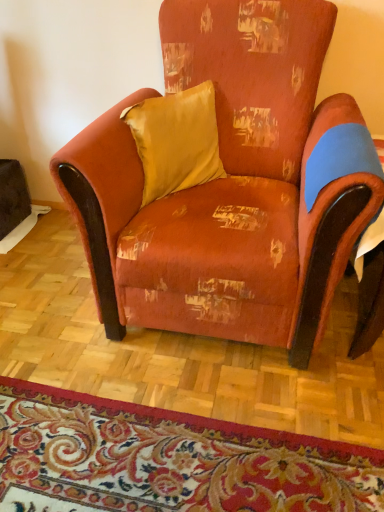
You are a GUI agent. You are given a task and a screenshot of the screen. Output one action in this format:
    pyautogui.click(x=<x>, y=<y>)
    Task: Click on the satin yellow pillow at upper center
    Image resolution: width=384 pixels, height=512 pixels.
    Given the screenshot: What is the action you would take?
    pyautogui.click(x=176, y=140)

In order to click on distressed orange fabric armchair at center in this screenshot , I will do `click(225, 187)`.

You are a GUI agent. You are given a task and a screenshot of the screen. Output one action in this format:
    pyautogui.click(x=<x>, y=<y>)
    Task: Click on the floral carpet at lower center
    The height and width of the screenshot is (512, 384).
    Given the screenshot: What is the action you would take?
    pyautogui.click(x=168, y=460)

From the picture: From the image's perspective, is distressed orange fabric armchair at center beneath satin yellow pillow at upper center?

Yes.

Is distressed orange fabric armchair at center thinner than satin yellow pillow at upper center?

No.

Considering the relative positions of distressed orange fabric armchair at center and satin yellow pillow at upper center in the image provided, is distressed orange fabric armchair at center to the left or to the right of satin yellow pillow at upper center?

In the image, distressed orange fabric armchair at center appears on the right side of satin yellow pillow at upper center.

In terms of height, does distressed orange fabric armchair at center look taller or shorter compared to satin yellow pillow at upper center?

In the image, distressed orange fabric armchair at center appears to be taller than satin yellow pillow at upper center.

Which is behind, point (329, 441) or point (266, 83)?

The point (266, 83) is farther.

Which of these two, floral carpet at lower center or distressed orange fabric armchair at center, is bigger?

Bigger between the two is distressed orange fabric armchair at center.

The image size is (384, 512). What are the coordinates of `chair that appears above the floral carpet at lower center (from the image's perspective)` in the screenshot? It's located at (225, 187).

Which of these two, floral carpet at lower center or distressed orange fabric armchair at center, stands taller?

With more height is distressed orange fabric armchair at center.

Is satin yellow pillow at upper center spatially inside distressed orange fabric armchair at center, or outside of it?

satin yellow pillow at upper center lies within the bounds of distressed orange fabric armchair at center.

From the image's perspective, is satin yellow pillow at upper center below distressed orange fabric armchair at center?

No, from the image's perspective, satin yellow pillow at upper center is not beneath distressed orange fabric armchair at center.

Considering the relative positions of satin yellow pillow at upper center and distressed orange fabric armchair at center in the image provided, is satin yellow pillow at upper center in front of distressed orange fabric armchair at center?

No, it is behind distressed orange fabric armchair at center.

Based on their sizes in the image, would you say satin yellow pillow at upper center is bigger or smaller than distressed orange fabric armchair at center?

Considering their sizes, satin yellow pillow at upper center takes up less space than distressed orange fabric armchair at center.

Which object is further away from the camera taking this photo, distressed orange fabric armchair at center or floral carpet at lower center?

floral carpet at lower center.

Is distressed orange fabric armchair at center facing towards floral carpet at lower center?

Yes.

Is distressed orange fabric armchair at center inside or outside of floral carpet at lower center?

distressed orange fabric armchair at center exists outside the volume of floral carpet at lower center.

Is point (246, 263) closer or farther from the camera than point (76, 453)?

Point (246, 263) appears to be farther away from the viewer than point (76, 453).

From a real-world perspective, is satin yellow pillow at upper center beneath floral carpet at lower center?

Actually, satin yellow pillow at upper center is physically above floral carpet at lower center in the real world.

Is satin yellow pillow at upper center thinner than floral carpet at lower center?

Indeed, satin yellow pillow at upper center has a lesser width compared to floral carpet at lower center.

Is satin yellow pillow at upper center further to camera compared to floral carpet at lower center?

Yes, it is.

From the image's perspective, between satin yellow pillow at upper center and floral carpet at lower center, which one is located above?

satin yellow pillow at upper center.

You are a GUI agent. You are given a task and a screenshot of the screen. Output one action in this format:
    pyautogui.click(x=<x>, y=<y>)
    Task: Click on the mat that appears below the satin yellow pillow at upper center (from a real-world perspective)
    The height and width of the screenshot is (512, 384).
    Given the screenshot: What is the action you would take?
    pyautogui.click(x=168, y=460)

Is floral carpet at lower center to the right of satin yellow pillow at upper center from the viewer's perspective?

No.

Which is in front, floral carpet at lower center or satin yellow pillow at upper center?

Positioned in front is floral carpet at lower center.

Locate an element on the screen. pillow that is on the left side of distressed orange fabric armchair at center is located at coordinates (176, 140).

You are a GUI agent. You are given a task and a screenshot of the screen. Output one action in this format:
    pyautogui.click(x=<x>, y=<y>)
    Task: Click on the chair lying above the floral carpet at lower center (from the image's perspective)
    Image resolution: width=384 pixels, height=512 pixels.
    Given the screenshot: What is the action you would take?
    pyautogui.click(x=225, y=187)

In the scene shown: Looking at the image, which one is located closer to distressed orange fabric armchair at center, satin yellow pillow at upper center or floral carpet at lower center?

Based on the image, satin yellow pillow at upper center appears to be nearer to distressed orange fabric armchair at center.

Based on their spatial positions, is distressed orange fabric armchair at center or floral carpet at lower center closer to satin yellow pillow at upper center?

The object closer to satin yellow pillow at upper center is distressed orange fabric armchair at center.

Which object lies further to the anchor point floral carpet at lower center, distressed orange fabric armchair at center or satin yellow pillow at upper center?

Among the two, satin yellow pillow at upper center is located further to floral carpet at lower center.

Looking at the image, which one is located further to floral carpet at lower center, satin yellow pillow at upper center or distressed orange fabric armchair at center?

Based on the image, satin yellow pillow at upper center appears to be further to floral carpet at lower center.

When comparing their distances from satin yellow pillow at upper center, does floral carpet at lower center or distressed orange fabric armchair at center seem further?

floral carpet at lower center lies further to satin yellow pillow at upper center than the other object.

Based on their spatial positions, is floral carpet at lower center or satin yellow pillow at upper center closer to distressed orange fabric armchair at center?

Among the two, satin yellow pillow at upper center is located nearer to distressed orange fabric armchair at center.

What are the coordinates of `chair between satin yellow pillow at upper center and floral carpet at lower center in the up-down direction` in the screenshot? It's located at (225, 187).